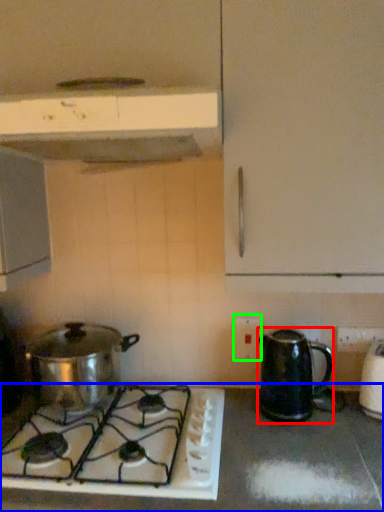
Question: Which object is the farthest from kitchen appliance (highlighted by a red box)? Choose among these: countertop (highlighted by a blue box) or electric outlet (highlighted by a green box).

Choices:
 (A) countertop
 (B) electric outlet

Answer: (A)